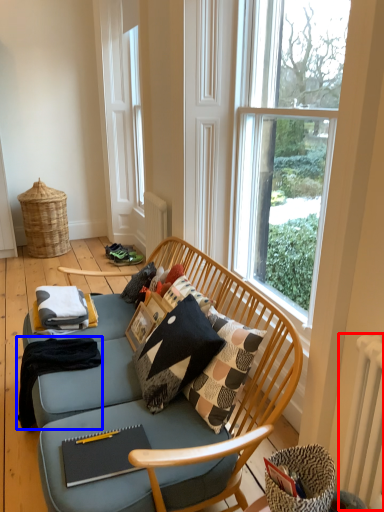
Question: Among these objects, which one is farthest to the camera, radiator (highlighted by a red box) or blanket (highlighted by a blue box)?

Choices:
 (A) radiator
 (B) blanket

Answer: (B)